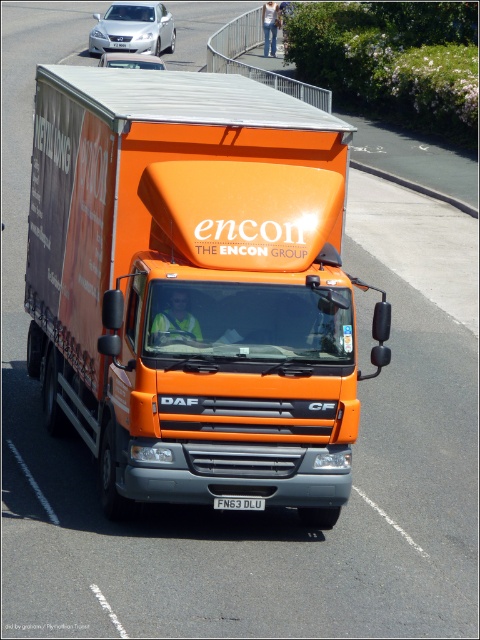
Question: Is orange matte truck at center in front of silver metallic sedan at upper left?

Choices:
 (A) no
 (B) yes

Answer: (B)

Question: Is orange matte truck at center below metallic silver car at upper center?

Choices:
 (A) yes
 (B) no

Answer: (A)

Question: Is orange matte truck at center to the left of metallic silver car at upper center from the viewer's perspective?

Choices:
 (A) no
 (B) yes

Answer: (A)

Question: Which object is positioned closest to the metallic silver car at upper center?

Choices:
 (A) silver metallic sedan at upper left
 (B) orange matte truck at center

Answer: (A)

Question: Which point is closer to the camera?

Choices:
 (A) (112, 54)
 (B) (133, 22)
 (C) (254, 499)
 (D) (282, 301)

Answer: (D)

Question: Which point is closer to the camera?

Choices:
 (A) (126, 58)
 (B) (132, 6)
 (C) (71, 340)
 (D) (253, 500)

Answer: (D)